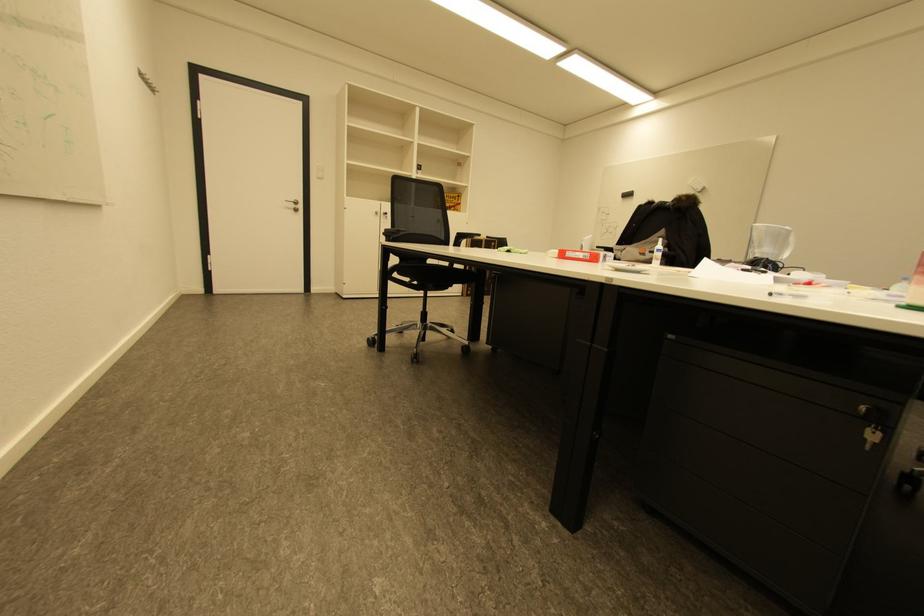
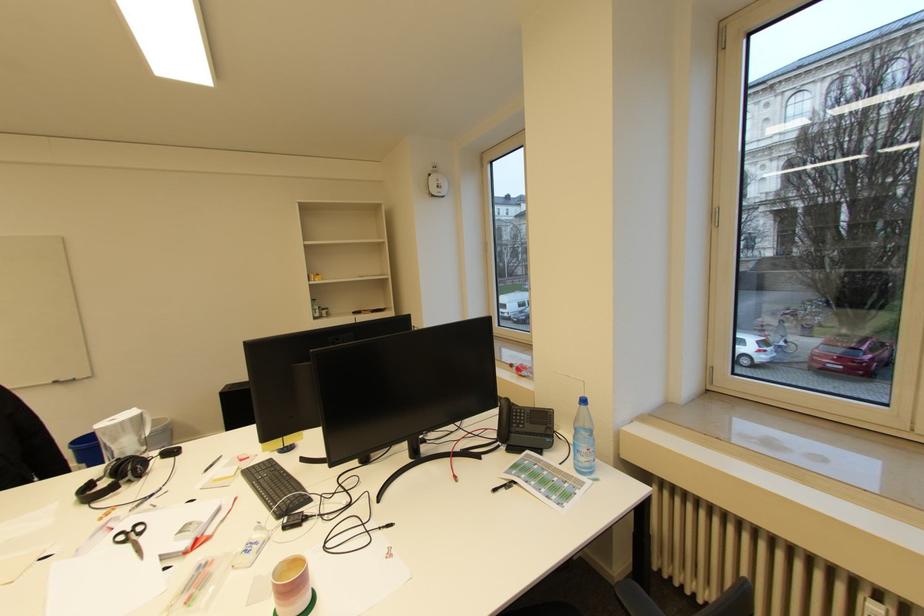
Question: How did the camera likely rotate?

Choices:
 (A) Left
 (B) Right
 (C) Up
 (D) Down

Answer: (B)